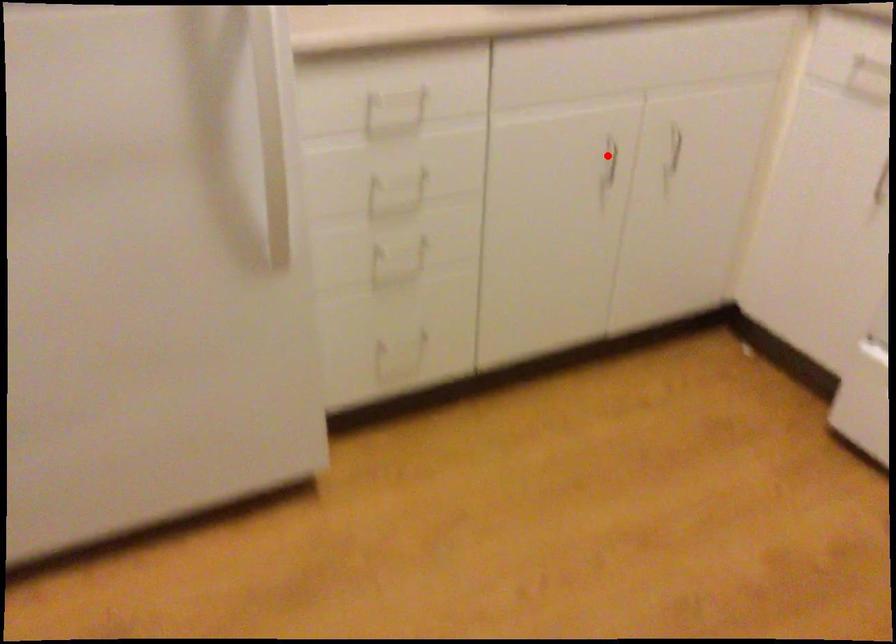
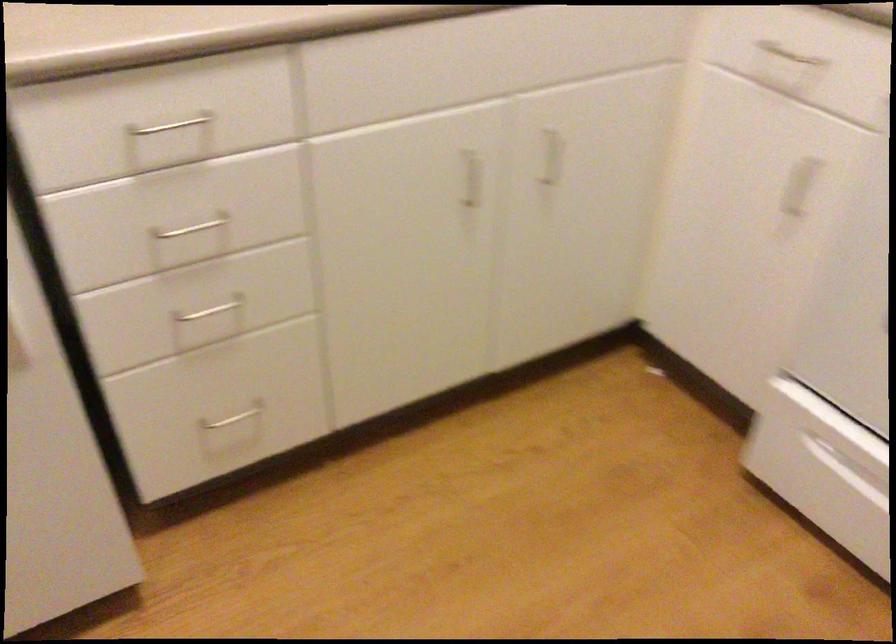
Question: I am providing you with two images of the same scene from different viewpoints. In image1, a red point is highlighted. Considering the same 3D point in image2, which of the following is correct?

Choices:
 (A) It is closer
 (B) It is farther

Answer: (A)